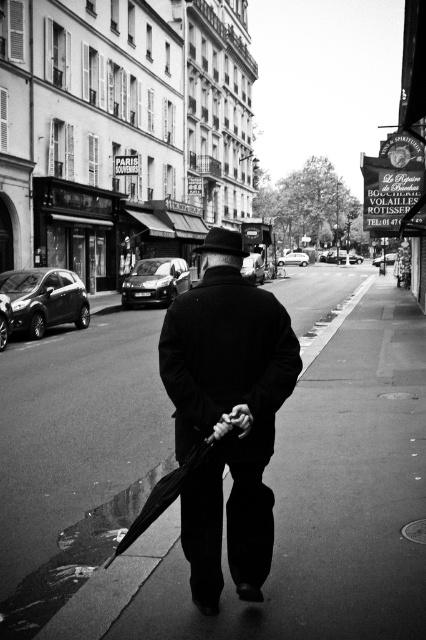
Question: Which point is farther to the camera?

Choices:
 (A) smooth asphalt sidewalk at center
 (B) black matte umbrella at center

Answer: (A)

Question: Does matte black coat at center appear on the left side of black matte umbrella at center?

Choices:
 (A) no
 (B) yes

Answer: (A)

Question: Does matte black coat at center have a lesser width compared to black matte umbrella at center?

Choices:
 (A) yes
 (B) no

Answer: (A)

Question: Does smooth asphalt sidewalk at center lie in front of matte black coat at center?

Choices:
 (A) yes
 (B) no

Answer: (A)

Question: Which of these objects is positioned closest to the black matte umbrella at center?

Choices:
 (A) matte black coat at center
 (B) smooth asphalt sidewalk at center

Answer: (A)

Question: Which point is closer to the camera?

Choices:
 (A) (183, 476)
 (B) (379, 456)
 (C) (265, 522)

Answer: (A)